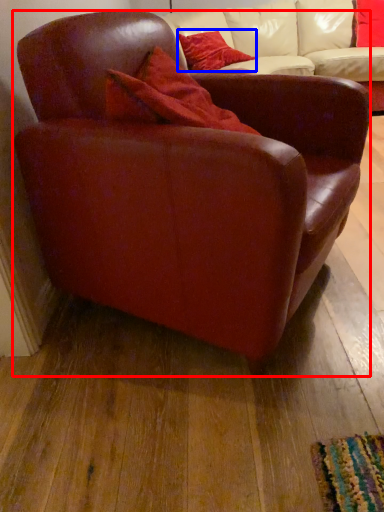
Question: Among these objects, which one is farthest to the camera, chair (highlighted by a red box) or pillow (highlighted by a blue box)?

Choices:
 (A) chair
 (B) pillow

Answer: (B)